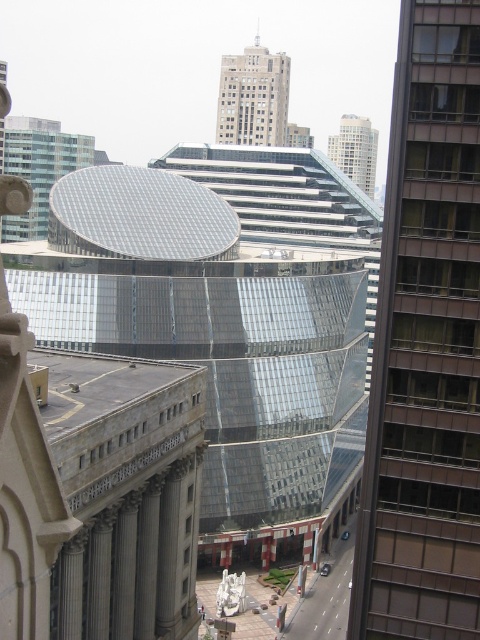
You are a drone operator trying to fly a drone between the gray concrete skyscraper at center and the adjacent traditional building. The drone has a maximum flight distance of 1000 feet. Can you safely fly the drone between them without exceeding its range?

The distance between the gray concrete skyscraper at center and the adjacent traditional building is 964.59 feet, which is within the drone operator maximum flight distance of 1000 feet. Yes, the drone can safely fly between them without exceeding its range.